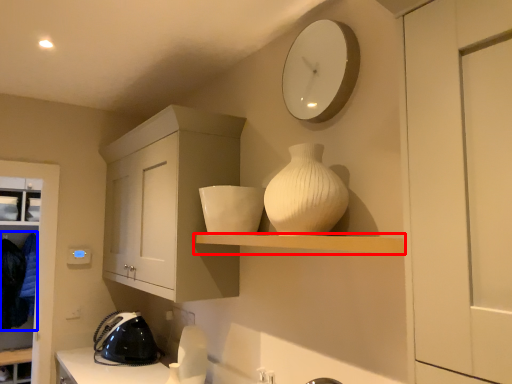
Question: Which object is closer to the camera taking this photo, shelf (highlighted by a red box) or laundry (highlighted by a blue box)?

Choices:
 (A) shelf
 (B) laundry

Answer: (A)